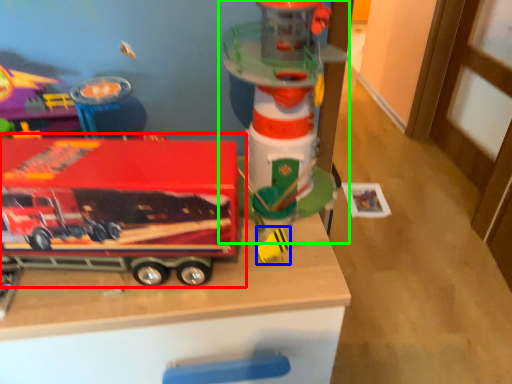
Question: Which is nearer to the toy (highlighted by a red box)? toy (highlighted by a blue box) or toy (highlighted by a green box).

Choices:
 (A) toy
 (B) toy

Answer: (B)